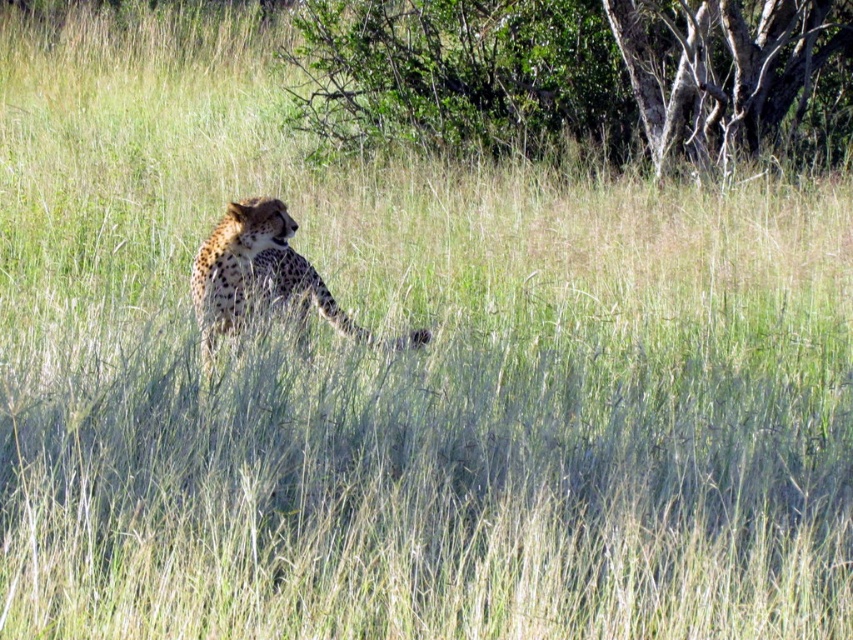
From the picture: You are a photographer trying to capture the smooth bark tree at upper right in the center of your photo. Based on its current position at point 0.108, 0.845, what adjustment should you make to the camera frame to center it?

To center the smooth bark tree at upper right, you should move the camera frame slightly to the left and downward since its current position is at point (720, 68), which is closer to the upper right corner of the frame.

You are a wildlife photographer aiming to capture a clear shot of the spotted fur cheetah at center. However, there is a green leafy tree at upper center in the way. Can you adjust your position to see the cheetah without the tree blocking the view?

The spotted fur cheetah at center is behind the green leafy tree at upper center, so moving your position to the right or left might allow you to see the cheetah without the tree blocking the view.

You are a photographer trying to capture a closeup of the cheetah. You have a camera with a zoom lens that can focus on a specific point. You notice two points of interest in the image labeled as point [799,26] and point [329,323]. Which point should you focus on to get a clearer image of the cheetah?

Point [329,323] is closer to the viewer than point [799,26]. Therefore, focusing on point [329,323] will provide a clearer image of the cheetah since it is closer.